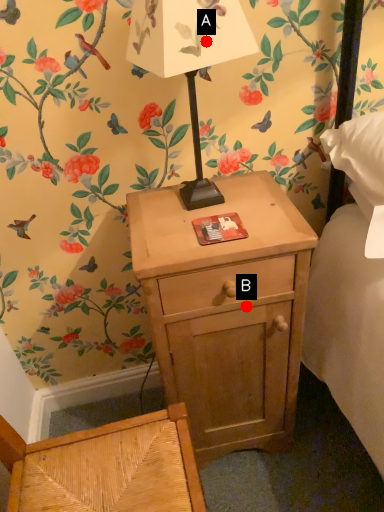
Question: Two points are circled on the image, labeled by A and B beside each circle. Which point appears farthest from the camera in this image?

Choices:
 (A) A is further
 (B) B is further

Answer: (B)